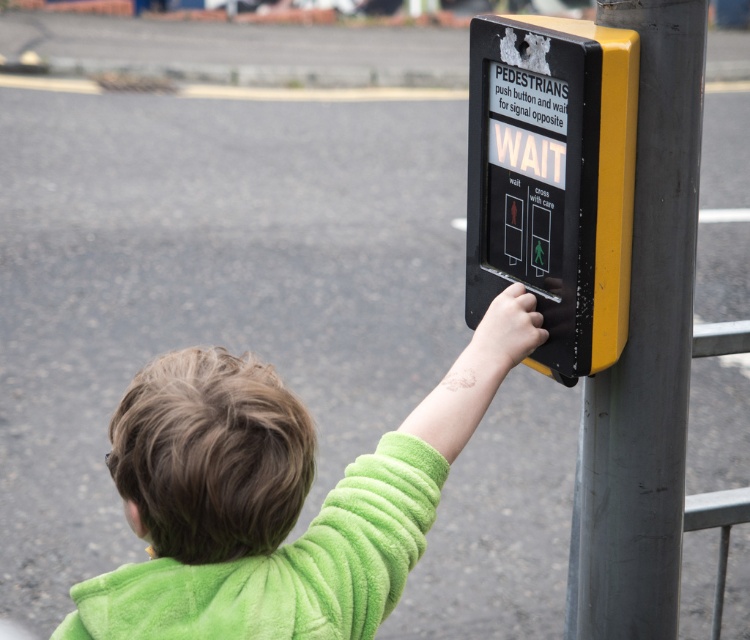
You are a visually impaired person using a cane to navigate the area. You feel a texture change under your cane. According to the scene description, what object might you have encountered at point (285, 500)?

The green fuzzy sweater at center is located at point (285, 500), so you have encountered the green fuzzy sweater at center.

Consider the image. You are a fashion designer observing a child wearing a green fuzzy sweater at center and a green fuzzy sweatshirt at upper right. Which clothing item is taller?

The green fuzzy sweater at center is taller than the green fuzzy sweatshirt at upper right.